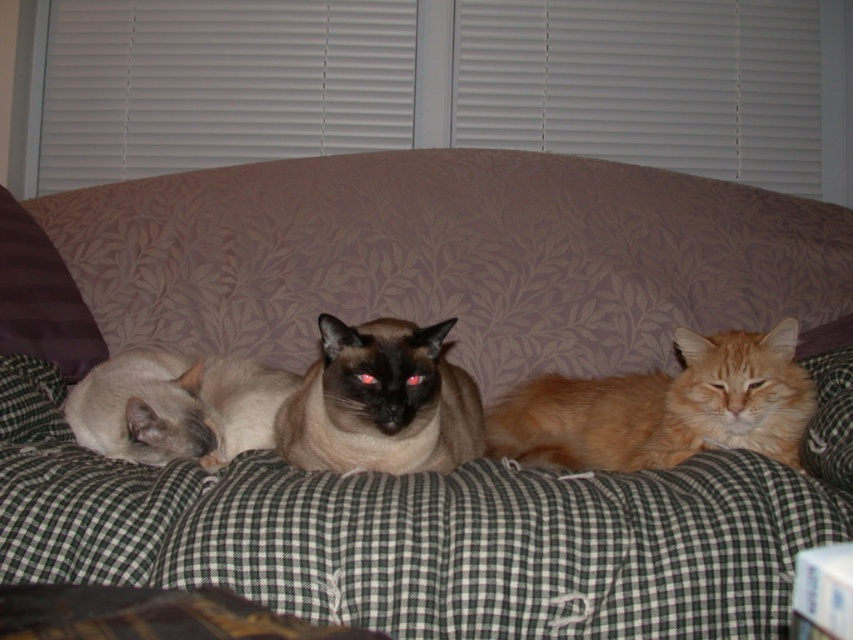
Question: Which point appears closest to the camera in this image?

Choices:
 (A) (374, 355)
 (B) (653, 465)
 (C) (142, 416)

Answer: (A)

Question: Does orange fluffy cat at center appear over smokey brown fur at center?

Choices:
 (A) yes
 (B) no

Answer: (B)

Question: Which point is closer to the camera?

Choices:
 (A) (323, 330)
 (B) (136, 384)

Answer: (A)

Question: Does smokey brown fur at center have a larger size compared to silky white cat at left?

Choices:
 (A) no
 (B) yes

Answer: (B)

Question: Can you confirm if orange fluffy cat at center is bigger than brown striped pillow at left?

Choices:
 (A) no
 (B) yes

Answer: (B)

Question: Which object is positioned farthest from the brown striped pillow at left?

Choices:
 (A) silky white cat at left
 (B) smokey brown fur at center

Answer: (B)